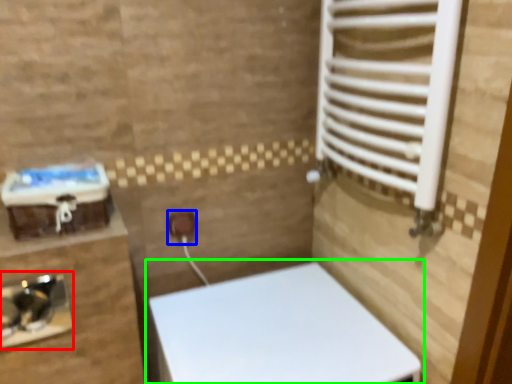
Question: Which object is positioned closest to sink (highlighted by a red box)? Select from electric outlet (highlighted by a blue box) and toilet (highlighted by a green box).

Choices:
 (A) electric outlet
 (B) toilet

Answer: (A)